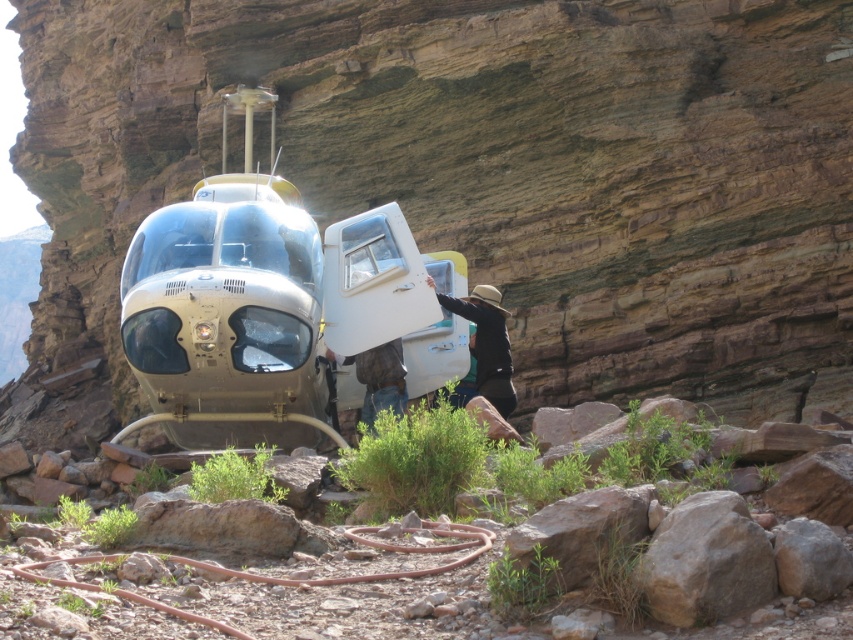
Is matte white helicopter at center behind metallic silver helicopter at center?

Yes, it is behind metallic silver helicopter at center.

Is matte white helicopter at center bigger than metallic silver helicopter at center?

Yes, matte white helicopter at center is bigger than metallic silver helicopter at center.

Is point (474, 182) more distant than point (183, 445)?

Yes, it is behind point (183, 445).

The width and height of the screenshot is (853, 640). In order to click on matte white helicopter at center in this screenshot , I will do `click(480, 173)`.

Describe the element at coordinates (486, 344) in the screenshot. I see `brown straw hat at center` at that location.

Image resolution: width=853 pixels, height=640 pixels. What are the coordinates of `brown straw hat at center` in the screenshot? It's located at (486, 344).

This screenshot has width=853, height=640. What are the coordinates of `matte white helicopter at center` in the screenshot? It's located at (480, 173).

Looking at this image, who is higher up, matte white helicopter at center or brown leather jacket at center?

matte white helicopter at center is above.

The image size is (853, 640). What are the coordinates of `matte white helicopter at center` in the screenshot? It's located at (480, 173).

The image size is (853, 640). Find the location of `matte white helicopter at center`. matte white helicopter at center is located at coordinates (480, 173).